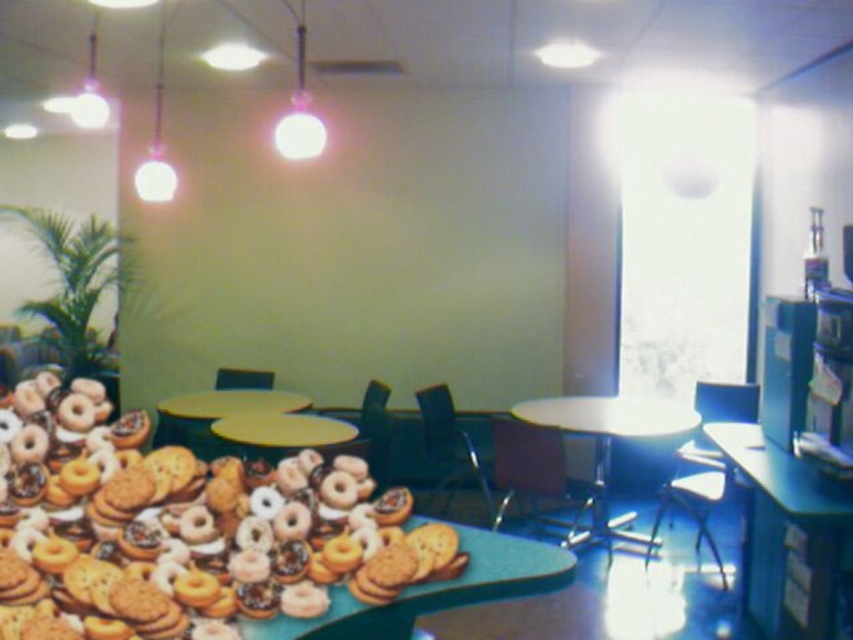
You are a person who wants to place a large coffee mug on the table. Which table, the yellow plastic table at center or the yellow matte table at center, should you choose to ensure the mug doesn

The yellow plastic table at center is much taller than the yellow matte table at center, so you should choose the yellow plastic table at center to place the large coffee mug because it provides a stable and appropriate height for the mug.

You are organizing a company event and need to place a 6.5 feet long banner between the white glossy table at center and the yellow plastic table at center. Can the banner fit between them?

The distance between the white glossy table at center and the yellow plastic table at center is 6.02 feet, which is shorter than the 6.5 feet banner. Therefore, the banner cannot fit between them.

You are standing in the break room and want to reach the two points marked on the floor. The first point is at coordinates point (605, 403) and the second is at point (286, 413). Which point is closer to you when you first enter the room?

Point (286, 413) is closer to you when you first enter the room because it is in front of point (605, 403).